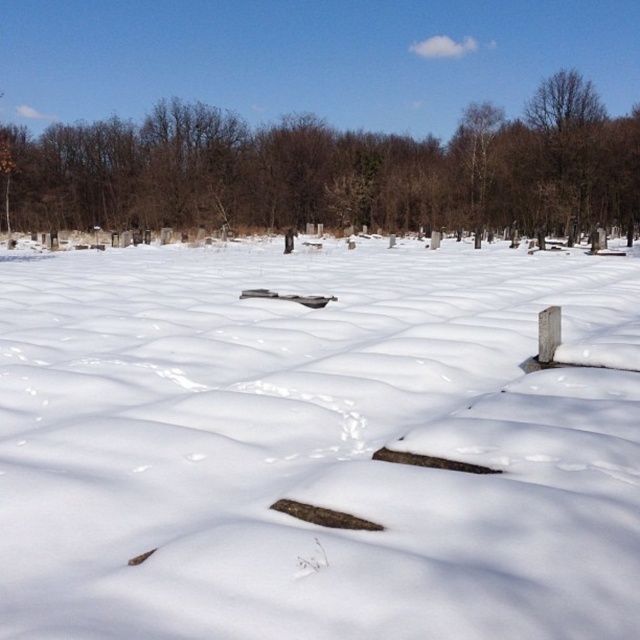
Is white fluffy snow at center closer to camera compared to brown wood tree at center?

Yes, white fluffy snow at center is in front of brown wood tree at center.

In the scene shown: Does white fluffy snow at center appear on the left side of brown wood tree at center?

Incorrect, white fluffy snow at center is not on the left side of brown wood tree at center.

From the picture: Who is more forward, (570, 426) or (561, 228)?

Point (570, 426) is more forward.

This screenshot has width=640, height=640. Find the location of `white fluffy snow at center`. white fluffy snow at center is located at coordinates (314, 445).